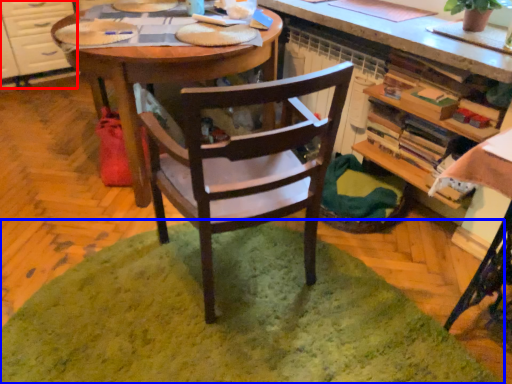
Question: Which object appears farthest to the camera in this image, cabinetry (highlighted by a red box) or mat (highlighted by a blue box)?

Choices:
 (A) cabinetry
 (B) mat

Answer: (A)